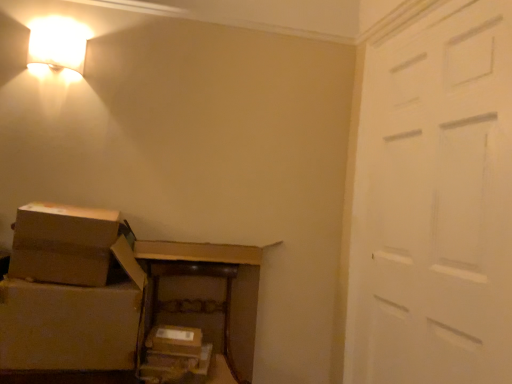
Question: Is matte white wall sconce at upper left facing towards brown cardboard box at lower center, the 2th storage box in the top-to-bottom sequence?

Choices:
 (A) no
 (B) yes

Answer: (A)

Question: Is matte white wall sconce at upper left positioned behind brown cardboard box at lower center, the 2th storage box in the top-to-bottom sequence?

Choices:
 (A) yes
 (B) no

Answer: (A)

Question: Can you confirm if matte white wall sconce at upper left is positioned to the right of brown cardboard box at lower center, the 2th storage box in the top-to-bottom sequence?

Choices:
 (A) no
 (B) yes

Answer: (A)

Question: Considering the relative sizes of matte white wall sconce at upper left and brown cardboard box at lower center, the 2th storage box in the top-to-bottom sequence, in the image provided, is matte white wall sconce at upper left shorter than brown cardboard box at lower center, the 2th storage box in the top-to-bottom sequence,?

Choices:
 (A) yes
 (B) no

Answer: (B)

Question: Does matte white wall sconce at upper left appear on the left side of brown cardboard box at lower center, marked as the 1th storage box in a bottom-to-top arrangement?

Choices:
 (A) no
 (B) yes

Answer: (B)

Question: Is matte white wall sconce at upper left smaller than brown cardboard box at lower center, marked as the 1th storage box in a bottom-to-top arrangement?

Choices:
 (A) no
 (B) yes

Answer: (B)

Question: From a real-world perspective, does brown cardboard box at lower center, which is the 1th storage box from top to bottom, sit lower than white matte door at right?

Choices:
 (A) no
 (B) yes

Answer: (B)

Question: Is brown cardboard box at lower center, which is the 1th storage box from top to bottom, oriented away from white matte door at right?

Choices:
 (A) no
 (B) yes

Answer: (A)

Question: Are brown cardboard box at lower center, which is the 1th storage box from top to bottom, and white matte door at right located far from each other?

Choices:
 (A) no
 (B) yes

Answer: (B)

Question: Is brown cardboard box at lower center, which is the 1th storage box from top to bottom, thinner than white matte door at right?

Choices:
 (A) yes
 (B) no

Answer: (B)

Question: Can you confirm if brown cardboard box at lower center, which is the 1th storage box from top to bottom, is positioned to the right of white matte door at right?

Choices:
 (A) yes
 (B) no

Answer: (B)

Question: Is brown cardboard box at lower center, which is the 1th storage box from top to bottom, positioned before white matte door at right?

Choices:
 (A) yes
 (B) no

Answer: (B)

Question: Considering the relative sizes of brown cardboard box at lower left, which ranks as the 2th box in top-to-bottom order, and brown cardboard box at lower center, which is the 1th storage box from top to bottom, in the image provided, is brown cardboard box at lower left, which ranks as the 2th box in top-to-bottom order, thinner than brown cardboard box at lower center, which is the 1th storage box from top to bottom,?

Choices:
 (A) yes
 (B) no

Answer: (B)